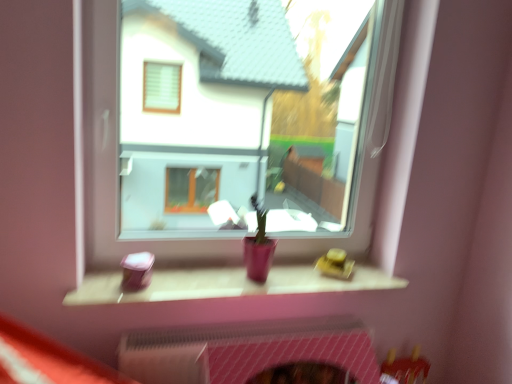
The width and height of the screenshot is (512, 384). Identify the location of free point below transparent glass window at center (from a real-world perspective). (208, 273).